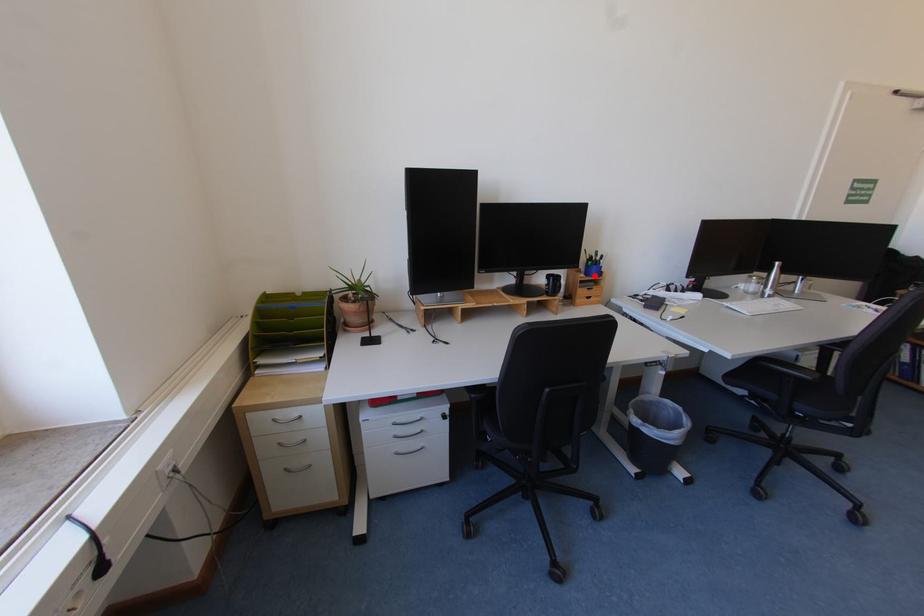
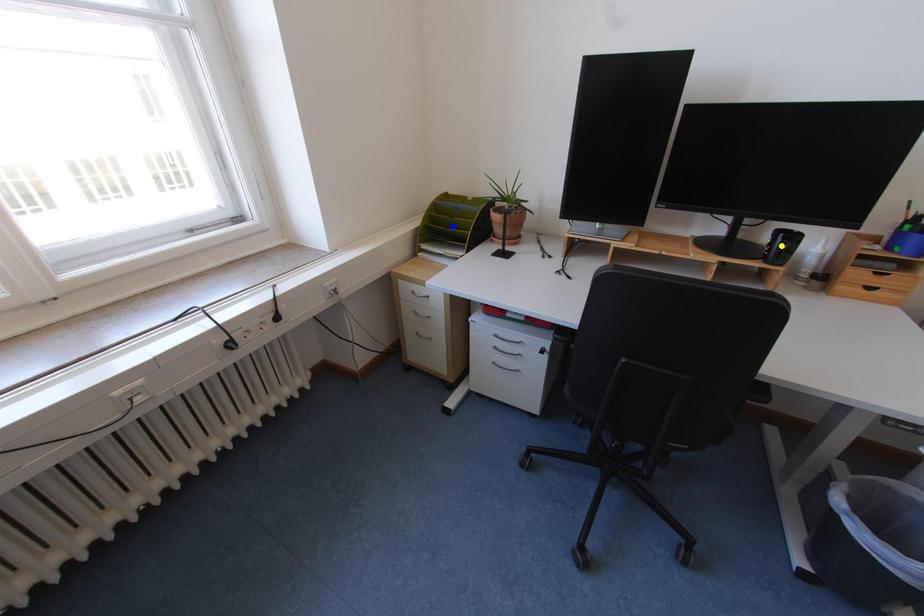
Question: I am providing you with two images of the same scene from different viewpoints. A red point is marked on the first image. You are given multiple points on the second image. Can you choose the point in image 2 that corresponds to the point in image 1?

Choices:
 (A) blue point
 (B) green point
 (C) yellow point

Answer: (B)